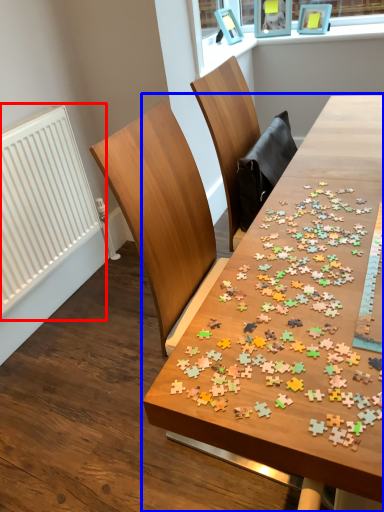
Question: Which point is further to the camera, radiator (highlighted by a red box) or table (highlighted by a blue box)?

Choices:
 (A) radiator
 (B) table

Answer: (A)